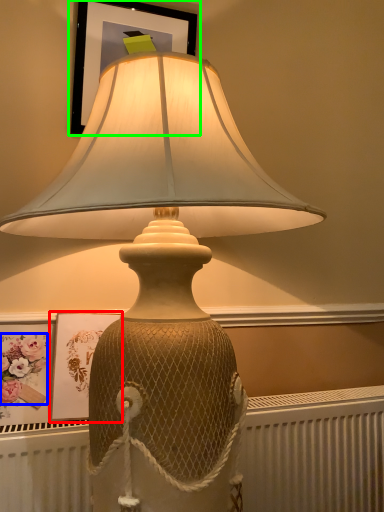
Question: Estimate the real-world distances between objects in this image. Which object is closer to picture frame (highlighted by a red box), flower (highlighted by a blue box) or picture frame (highlighted by a green box)?

Choices:
 (A) flower
 (B) picture frame

Answer: (A)